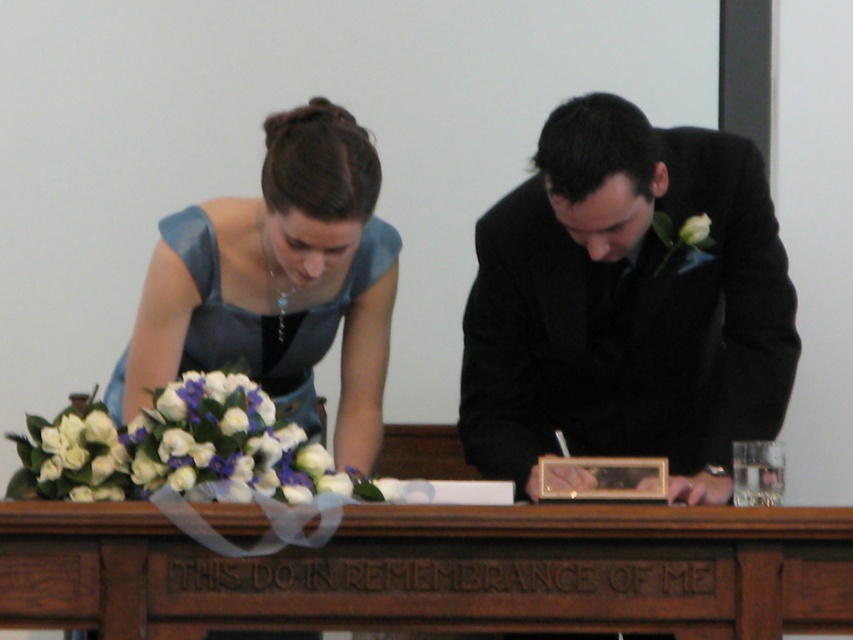
Question: Does matte blue dress at center have a smaller size compared to white matte flowers at center?

Choices:
 (A) no
 (B) yes

Answer: (A)

Question: Can you confirm if black satin suit at center is positioned to the right of white matte flower at right?

Choices:
 (A) yes
 (B) no

Answer: (B)

Question: Based on their relative distances, which object is nearer to the black satin suit at center?

Choices:
 (A) matte blue dress at center
 (B) teal satin dress at upper left
 (C) white matte flower at right
 (D) brown wooden table at center

Answer: (A)

Question: Which is farther from the white matte flower at right?

Choices:
 (A) black satin suit at center
 (B) teal satin dress at upper left
 (C) matte blue dress at center
 (D) white matte flowers at center

Answer: (D)

Question: Which object is positioned farthest from the matte blue dress at center?

Choices:
 (A) black satin suit at center
 (B) teal satin dress at upper left

Answer: (B)

Question: Where is matte blue dress at center located in relation to black satin suit at center in the image?

Choices:
 (A) left
 (B) right

Answer: (A)